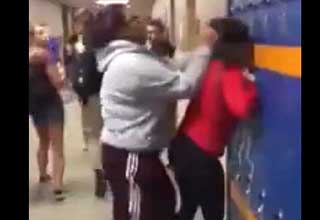
In order to click on locker handle in this screenshot , I will do `click(259, 210)`.